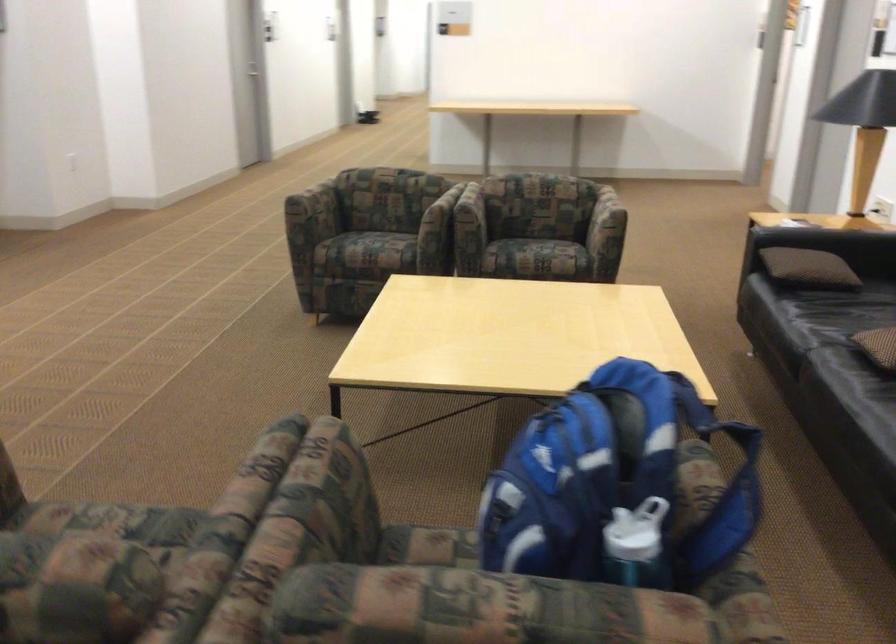
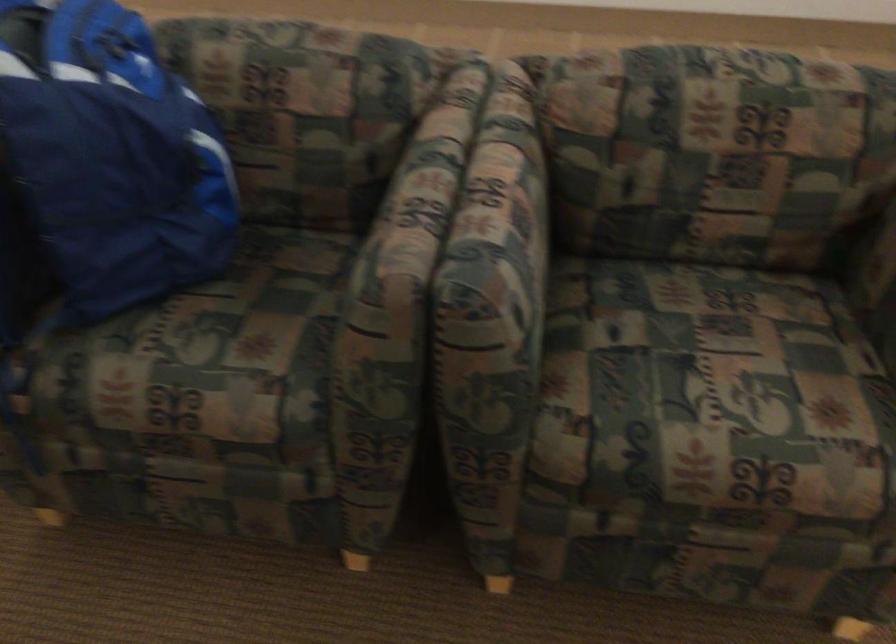
Where in the second image is the point corresponding to the point at 236,474 from the first image?

(510, 196)